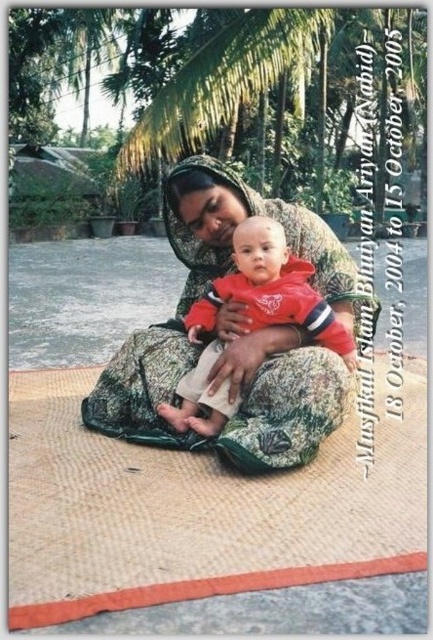
Does burlap mat at center appear over camouflage fabric at center?

Actually, burlap mat at center is below camouflage fabric at center.

Is burlap mat at center taller than camouflage fabric at center?

In fact, burlap mat at center may be shorter than camouflage fabric at center.

What do you see at coordinates (197, 508) in the screenshot?
I see `burlap mat at center` at bounding box center [197, 508].

What are the coordinates of `burlap mat at center` in the screenshot? It's located at (197, 508).

Between camouflage fabric at center and red fleece jacket at center, which one is positioned lower?

red fleece jacket at center

Who is more forward, (158, 392) or (242, 260)?

Point (242, 260) is more forward.

I want to click on camouflage fabric at center, so 236,333.

This screenshot has width=433, height=640. In order to click on burlap mat at center in this screenshot , I will do `click(197, 508)`.

Does burlap mat at center have a smaller size compared to red fleece jacket at center?

No.

Who is more distant from viewer, (x=168, y=476) or (x=190, y=401)?

Point (x=190, y=401)

Find the location of a particular element. The height and width of the screenshot is (640, 433). burlap mat at center is located at coordinates (197, 508).